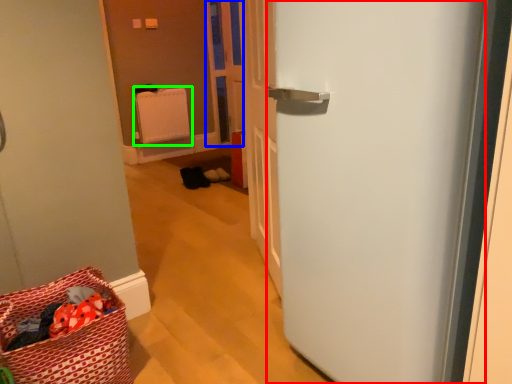
Question: Which object is positioned farthest from door (highlighted by a red box)? Select from screen door (highlighted by a blue box) and radiator (highlighted by a green box).

Choices:
 (A) screen door
 (B) radiator

Answer: (B)